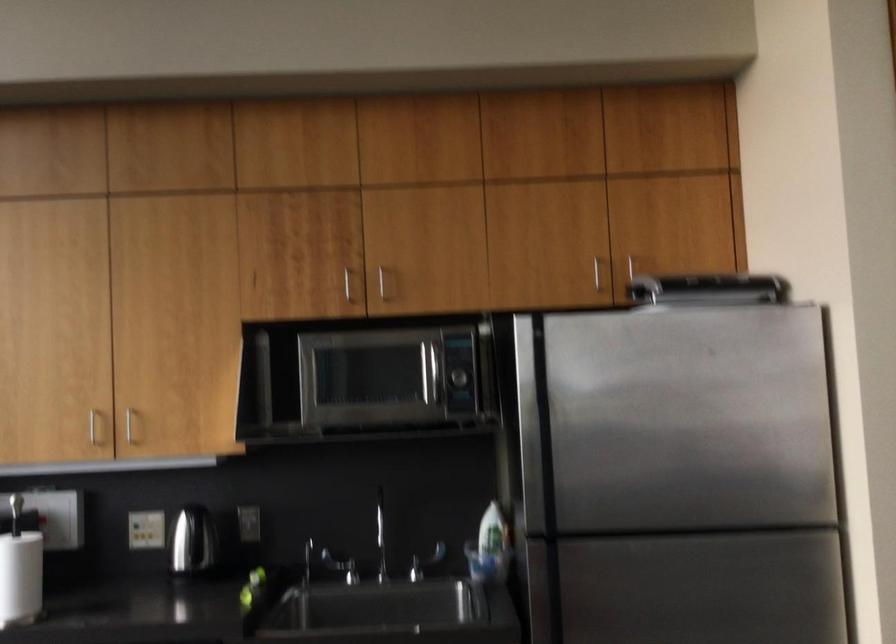
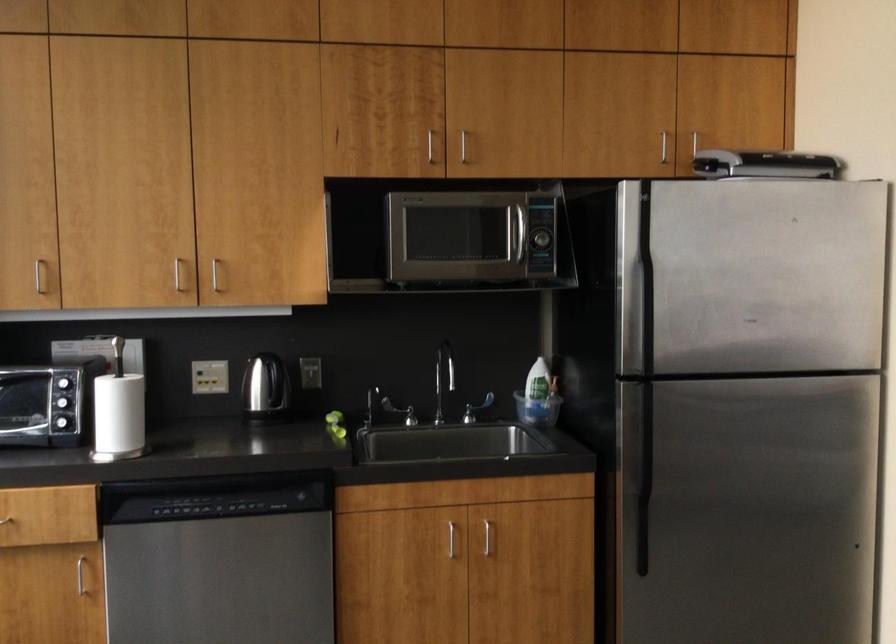
Find the pixel in the second image that matches pixel 389 516 in the first image.

(444, 371)